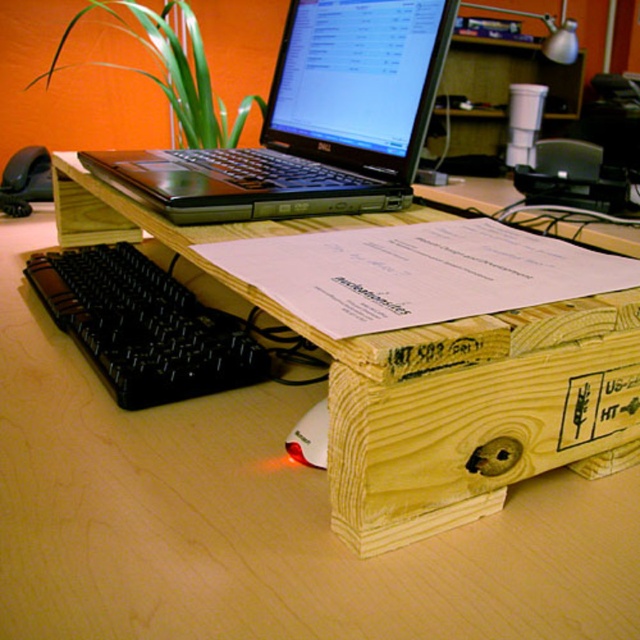
Question: Does black plastic keyboard at lower left lie in front of white matte mouse at lower center?

Choices:
 (A) yes
 (B) no

Answer: (B)

Question: Which of the following is the closest to the observer?

Choices:
 (A) (122, 272)
 (B) (320, 416)

Answer: (B)

Question: Among these objects, which one is farthest from the camera?

Choices:
 (A) black matte laptop at upper center
 (B) black plastic keyboard at lower left
 (C) white matte mouse at lower center

Answer: (A)

Question: Does black matte laptop at upper center have a larger size compared to black plastic keyboard at lower left?

Choices:
 (A) yes
 (B) no

Answer: (A)

Question: Which object is positioned farthest from the white matte mouse at lower center?

Choices:
 (A) black plastic keyboard at lower left
 (B) black matte laptop at upper center

Answer: (B)

Question: Where is black plastic keyboard at lower left located in relation to white matte mouse at lower center in the image?

Choices:
 (A) below
 (B) above

Answer: (B)